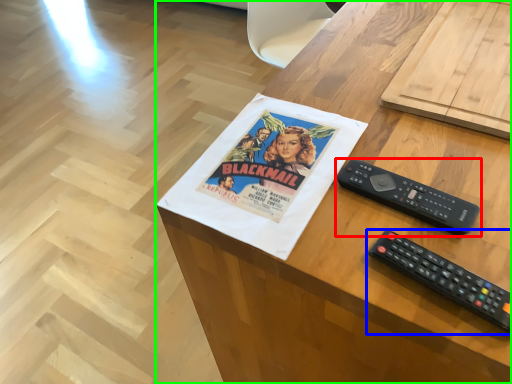
Question: Which object is the closest to the remote control (highlighted by a red box)? Choose among these: remote control (highlighted by a blue box) or desk (highlighted by a green box).

Choices:
 (A) remote control
 (B) desk

Answer: (A)